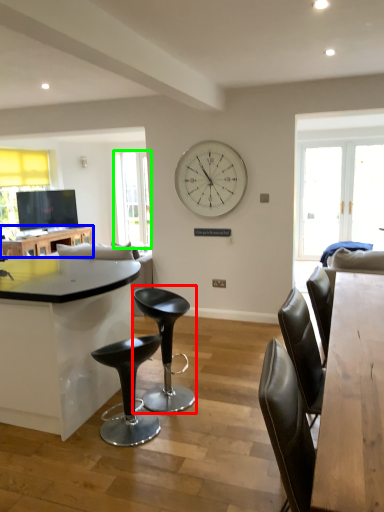
Question: Which is nearer to the chair (highlighted by a red box)? table (highlighted by a blue box) or window screen (highlighted by a green box).

Choices:
 (A) table
 (B) window screen

Answer: (A)